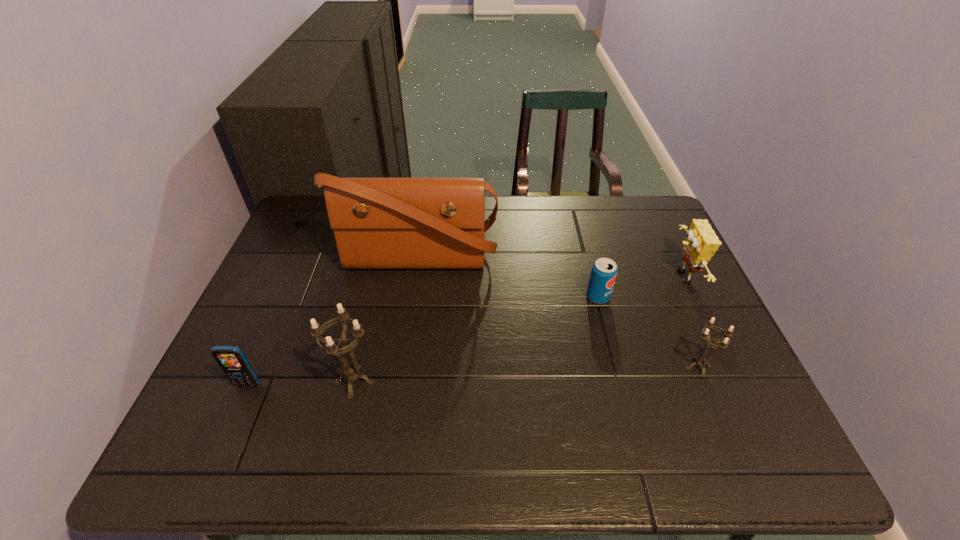
This screenshot has width=960, height=540. Find the location of `the taller candle holder`. the taller candle holder is located at coordinates (351, 374).

At what (x,y) coordinates should I click in order to perform the action: click on the left candle holder. Please return your answer as a coordinate pair (x, y). Looking at the image, I should click on (351, 374).

Find the location of `the shorter candle holder`. the shorter candle holder is located at coordinates (702, 362).

This screenshot has height=540, width=960. Find the location of `the tallest object`. the tallest object is located at coordinates (379, 223).

Find the location of a particular element. soda can is located at coordinates (604, 271).

Locate an element on the screen. This screenshot has width=960, height=540. the third object from right to left is located at coordinates (604, 271).

At what (x,y) coordinates should I click in order to perform the action: click on cellular telephone. Please return your answer as a coordinate pair (x, y). Looking at the image, I should click on (231, 359).

The image size is (960, 540). In order to click on sponge in this screenshot , I will do `click(701, 243)`.

You are a GUI agent. You are given a task and a screenshot of the screen. Output one action in this format:
    pyautogui.click(x=<x>, y=<y>)
    Task: Click on the free space located on the left of the fifth shortest object
    
    Given the screenshot: What is the action you would take?
    pyautogui.click(x=278, y=381)

I want to click on free space located 0.070m on the left of the shorter candle holder, so click(653, 367).